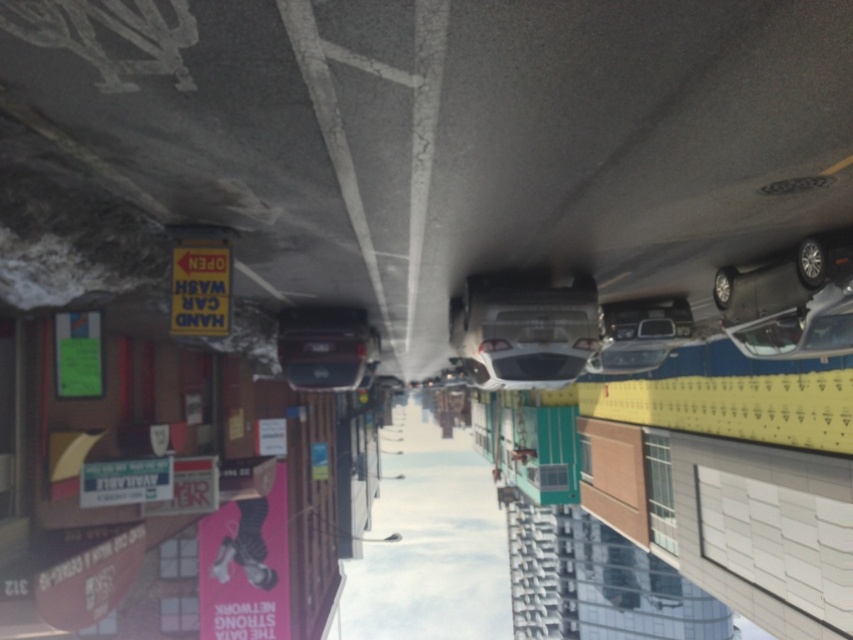
You are driving a car and see the shiny black car at center and the shiny silver car at right. Which car is blocking your path?

The shiny black car at center is blocking your path because it is in front of the shiny silver car at right.